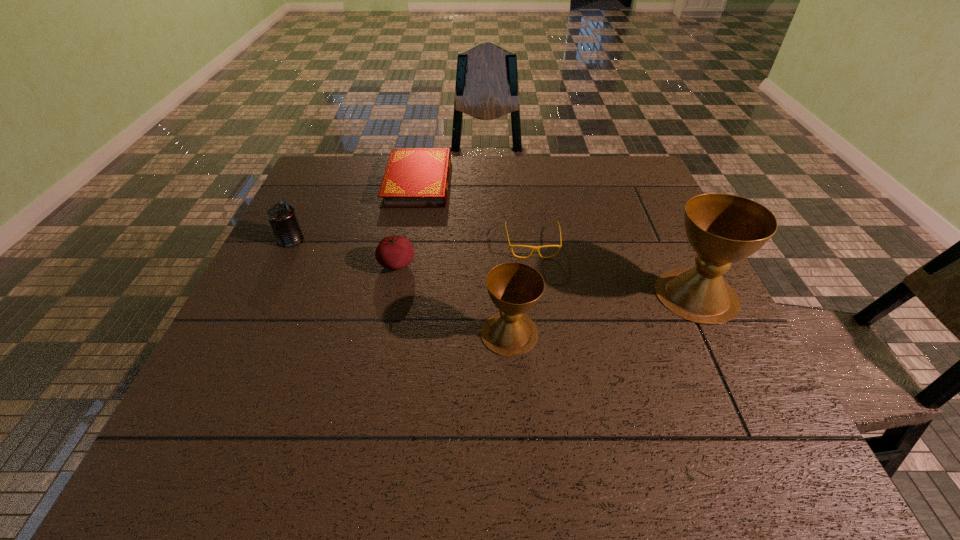
The height and width of the screenshot is (540, 960). What are the coordinates of `vacant spot to place a chalice on the left` in the screenshot? It's located at (288, 378).